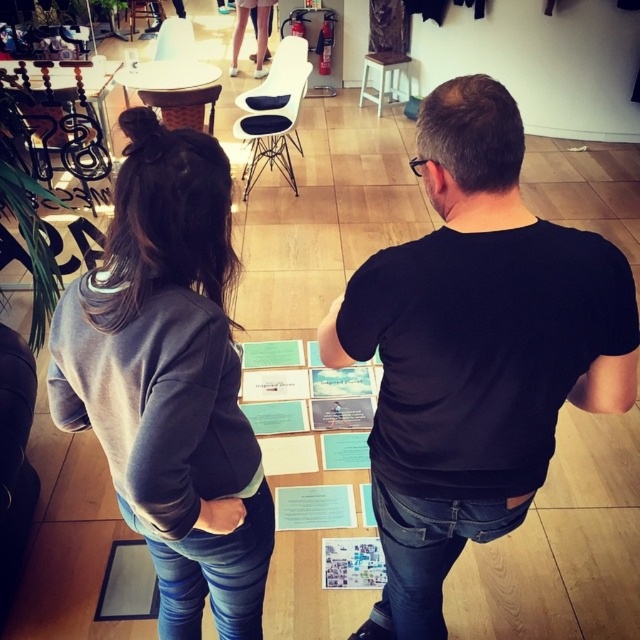
Question: Does black matte shirt at center lie behind gray fleece sweatshirt at left?

Choices:
 (A) yes
 (B) no

Answer: (A)

Question: Which of these objects is positioned closest to the black matte shirt at center?

Choices:
 (A) white plastic stool at upper center
 (B) gray fleece sweatshirt at left

Answer: (B)

Question: Which of the following is the farthest from the observer?

Choices:
 (A) white plastic stool at upper center
 (B) gray fleece sweatshirt at left
 (C) black matte shirt at center

Answer: (A)

Question: Which object appears closest to the camera in this image?

Choices:
 (A) gray fleece sweatshirt at left
 (B) white plastic stool at upper center
 (C) black matte shirt at center

Answer: (A)

Question: Can you confirm if black matte shirt at center is positioned above white plastic stool at upper center?

Choices:
 (A) yes
 (B) no

Answer: (B)

Question: Can you confirm if black matte shirt at center is positioned to the left of white plastic stool at upper center?

Choices:
 (A) yes
 (B) no

Answer: (A)